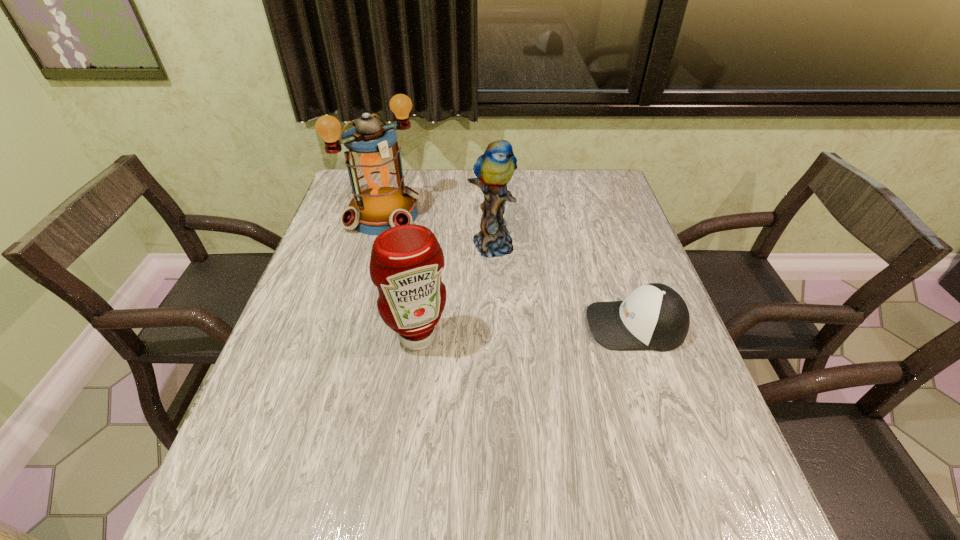
Identify the location of free space between the condiment and the parrot. This screenshot has width=960, height=540. (454, 290).

I want to click on free space between the parrot and the lantern, so click(x=438, y=229).

Identify which object is the third closest to the cap. Please provide its 2D coordinates. Your answer should be formatted as a tuple, i.e. [(x, y)], where the tuple contains the x and y coordinates of a point satisfying the conditions above.

[(381, 200)]

Choose which object is the second nearest neighbor to the condiment. Please provide its 2D coordinates. Your answer should be formatted as a tuple, i.e. [(x, y)], where the tuple contains the x and y coordinates of a point satisfying the conditions above.

[(381, 200)]

At what (x,y) coordinates should I click in order to perform the action: click on free location that satisfies the following two spatial constraints: 1. on the front side of the lantern; 2. on the front panel of the cap. Please return your answer as a coordinate pair (x, y). The width and height of the screenshot is (960, 540). Looking at the image, I should click on (353, 325).

Identify the location of blank area in the image that satisfies the following two spatial constraints: 1. on the back side of the third tallest object; 2. on the left side of the second object from right to left. (430, 243).